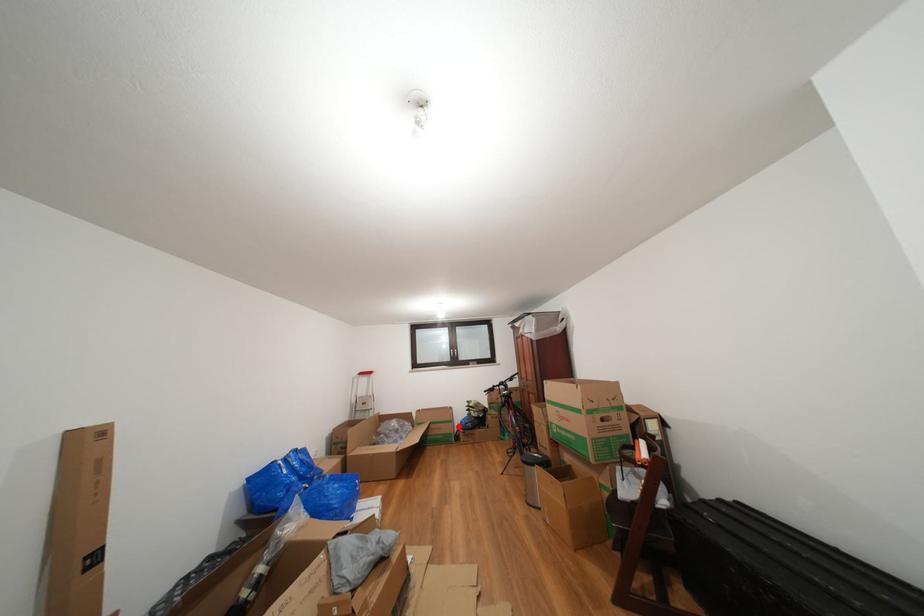
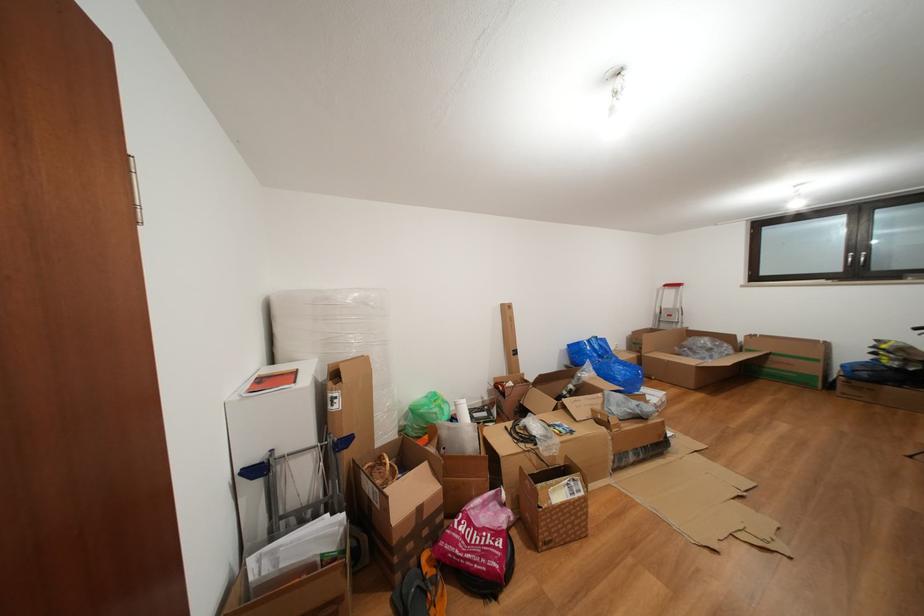
Question: I am providing you with two images of the same scene from different viewpoints. In image1, a red point is highlighted. Considering the same 3D point in image2, which of the following is correct?

Choices:
 (A) It is closer
 (B) It is farther

Answer: (A)